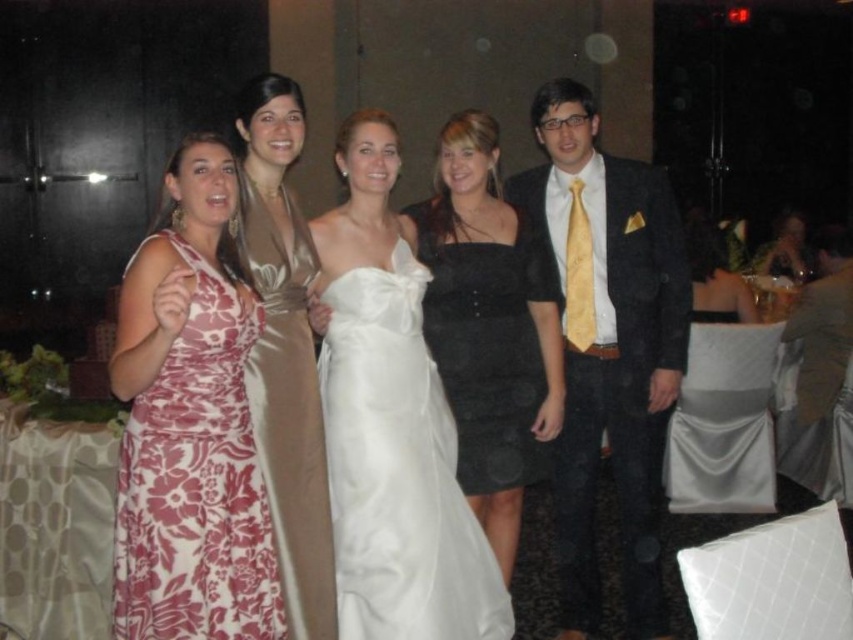
Image resolution: width=853 pixels, height=640 pixels. Describe the element at coordinates (398, 472) in the screenshot. I see `white satin dress at center` at that location.

Does white satin dress at center have a smaller size compared to black satin dress at center?

Yes, white satin dress at center is smaller than black satin dress at center.

You are a GUI agent. You are given a task and a screenshot of the screen. Output one action in this format:
    pyautogui.click(x=<x>, y=<y>)
    Task: Click on the white satin dress at center
    Image resolution: width=853 pixels, height=640 pixels.
    Given the screenshot: What is the action you would take?
    pyautogui.click(x=398, y=472)

The image size is (853, 640). In order to click on white satin dress at center in this screenshot , I will do `click(398, 472)`.

Which is more to the left, white satin dress at center or floral-patterned fabric dress at left?

floral-patterned fabric dress at left is more to the left.

Is point (390, 572) positioned before point (242, 528)?

No, (390, 572) is further to viewer.

The image size is (853, 640). In order to click on white satin dress at center in this screenshot , I will do `click(398, 472)`.

Find the location of a particular element. black satin dress at center is located at coordinates (488, 326).

Is black satin dress at center wider than satin dress at center?

Yes.

Who is more forward, (x=477, y=481) or (x=302, y=330)?

Point (x=302, y=330) is in front.

Where is `black satin dress at center`? The height and width of the screenshot is (640, 853). black satin dress at center is located at coordinates (488, 326).